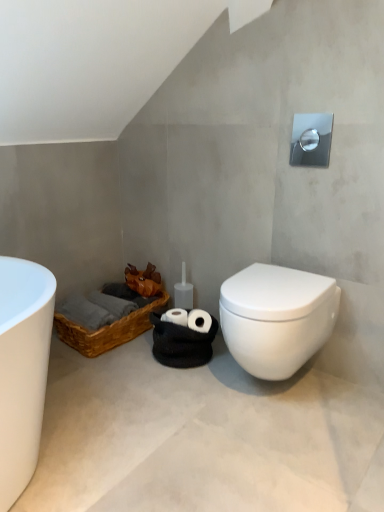
In order to click on vacant area in front of brown woven basket at lower left in this screenshot , I will do `click(120, 380)`.